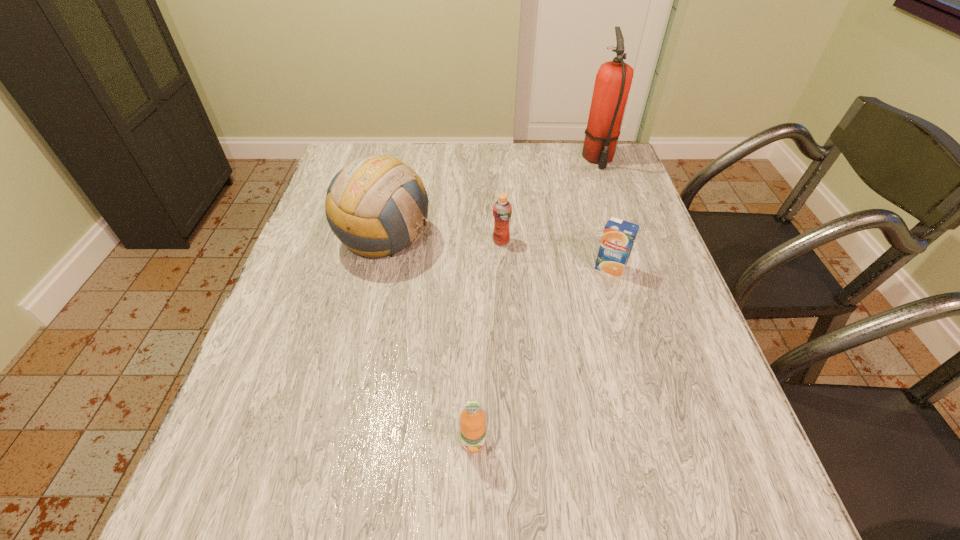
Find the location of `blank region between the leftmost object and the nearest object`. blank region between the leftmost object and the nearest object is located at coordinates (429, 341).

Where is `empty space between the nearest orange juice and the leftmost object`? The height and width of the screenshot is (540, 960). empty space between the nearest orange juice and the leftmost object is located at coordinates (429, 341).

In order to click on vacant area between the rightmost orange juice and the fire extinguisher in this screenshot , I will do `click(604, 214)`.

At what (x,y) coordinates should I click in order to perform the action: click on vacant area that lies between the farthest orange juice and the second tallest object. Please return your answer as a coordinate pair (x, y). The height and width of the screenshot is (540, 960). Looking at the image, I should click on (444, 240).

At what (x,y) coordinates should I click in order to perform the action: click on vacant area between the farthest orange juice and the farthest object. Please return your answer as a coordinate pair (x, y). This screenshot has height=540, width=960. Looking at the image, I should click on (549, 200).

The height and width of the screenshot is (540, 960). What are the coordinates of `vacant space that is in between the second orange juice from right to left and the rightmost orange juice` in the screenshot? It's located at (556, 255).

Identify the location of empty space between the volleyball and the second orange juice from left to right. The image size is (960, 540). (444, 240).

Identify the location of object that is the closest to the third object from left to right. The width and height of the screenshot is (960, 540). (376, 205).

The width and height of the screenshot is (960, 540). In order to click on the third closest object to the second nearest orange juice in this screenshot , I will do `click(376, 205)`.

At what (x,y) coordinates should I click in order to perform the action: click on orange juice that is the third nearest to the fire extinguisher. Please return your answer as a coordinate pair (x, y). Looking at the image, I should click on (472, 418).